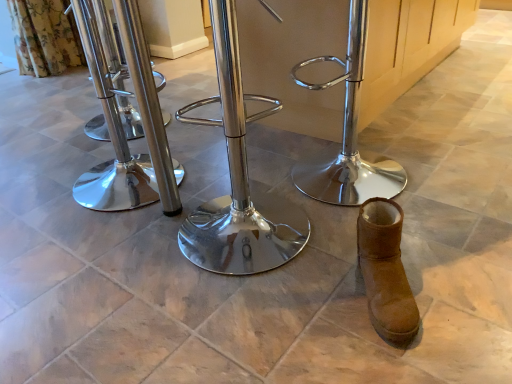
Find the location of a particular element. The image size is (512, 384). vacant area that is in front of polished metal swivel chair at center, marked as the first swivel chair in a left-to-right arrangement is located at coordinates (91, 246).